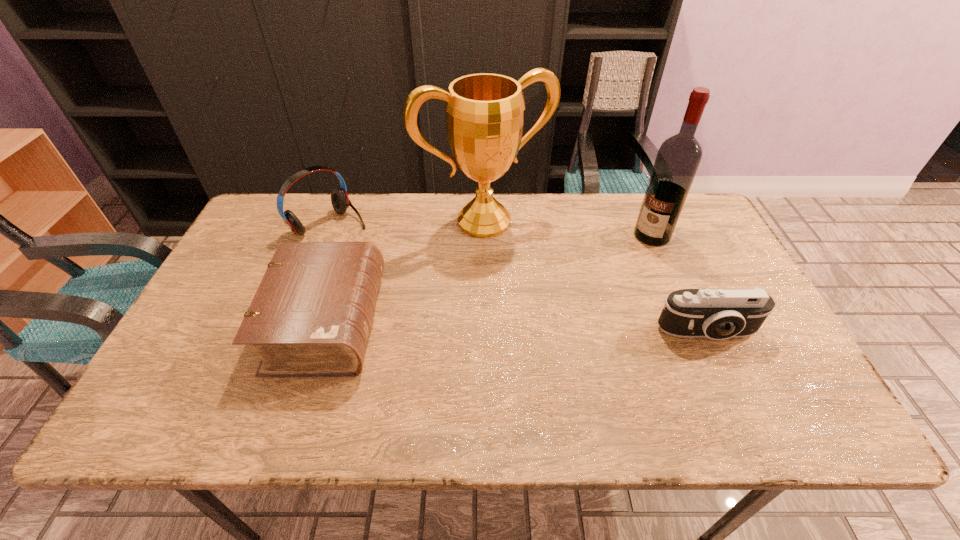
This screenshot has height=540, width=960. I want to click on empty space between the third tallest object and the camera, so click(x=519, y=279).

Image resolution: width=960 pixels, height=540 pixels. Find the location of `free area in between the Bible and the award`. free area in between the Bible and the award is located at coordinates (405, 272).

Locate an element on the screen. The width and height of the screenshot is (960, 540). free space between the headset and the award is located at coordinates click(x=407, y=222).

Where is `free point between the camera and the headset`? The width and height of the screenshot is (960, 540). free point between the camera and the headset is located at coordinates (519, 279).

Locate an element on the screen. The image size is (960, 540). free space that is in between the camera and the third tallest object is located at coordinates (519, 279).

This screenshot has width=960, height=540. In order to click on blank region between the third object from left to right and the camera in this screenshot , I will do `click(596, 277)`.

Find the location of a particular element. vacant space in between the Bible and the award is located at coordinates (405, 272).

Where is `the fourth closest object relative to the Bible`? Image resolution: width=960 pixels, height=540 pixels. the fourth closest object relative to the Bible is located at coordinates (678, 158).

Identify the location of object that is the fourth closest to the camera. The width and height of the screenshot is (960, 540). (340, 201).